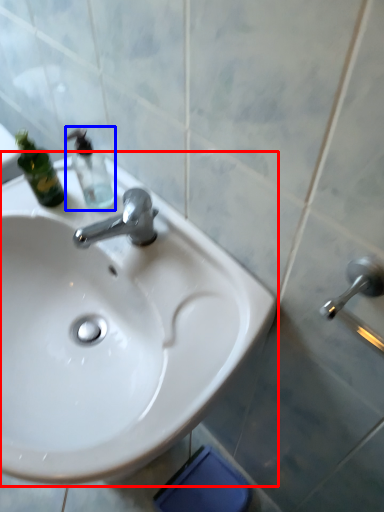
Question: Among these objects, which one is nearest to the camera, sink (highlighted by a red box) or bottle (highlighted by a blue box)?

Choices:
 (A) sink
 (B) bottle

Answer: (A)